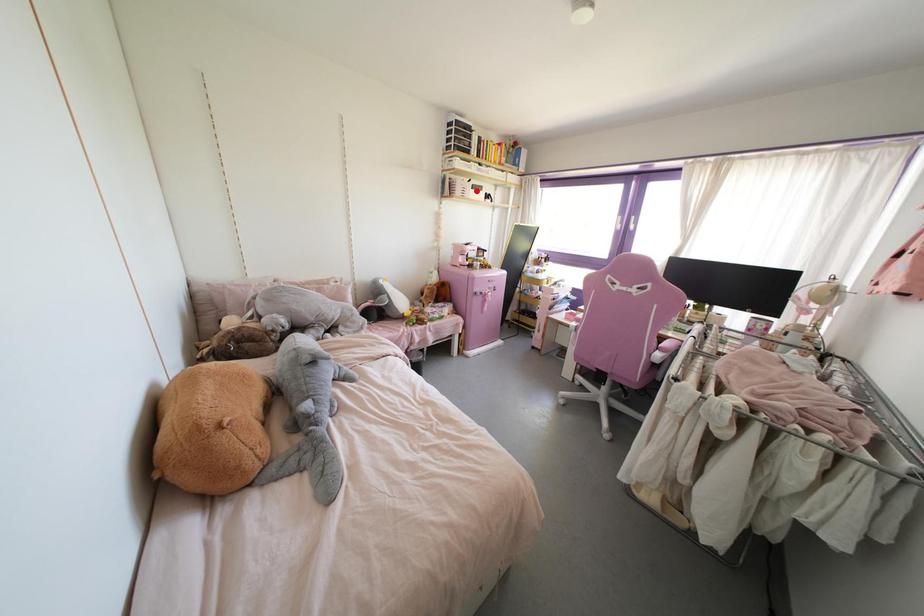
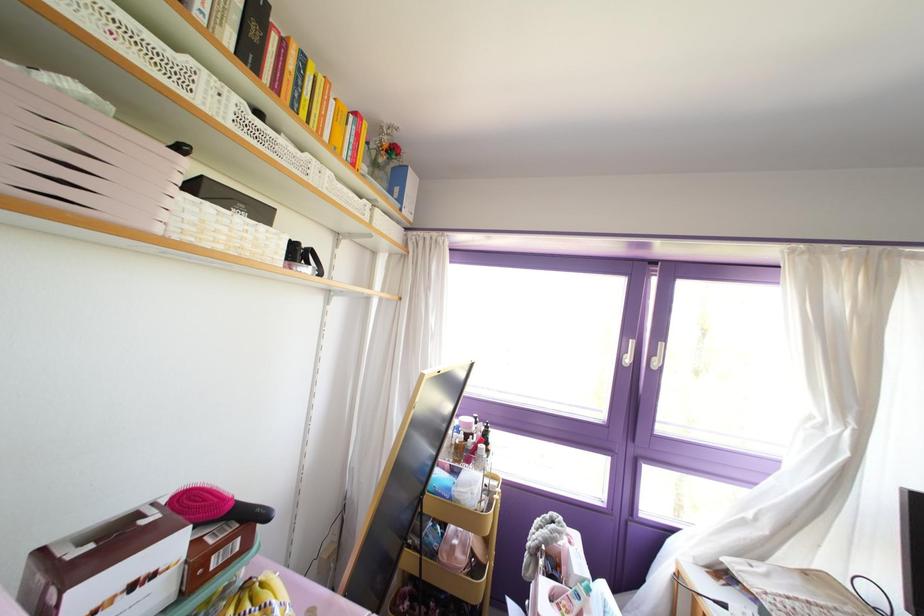
Where in the second image is the point corresponding to the highlighted location from the first image?

(237, 219)